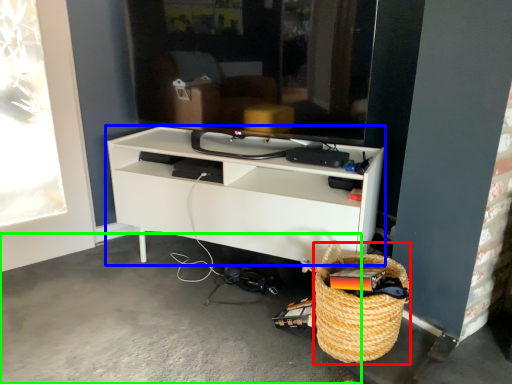
Question: Based on their relative distances, which object is nearer to basket (highlighted by a red box)? Choose from shelf (highlighted by a blue box) and concrete (highlighted by a green box).

Choices:
 (A) shelf
 (B) concrete

Answer: (A)